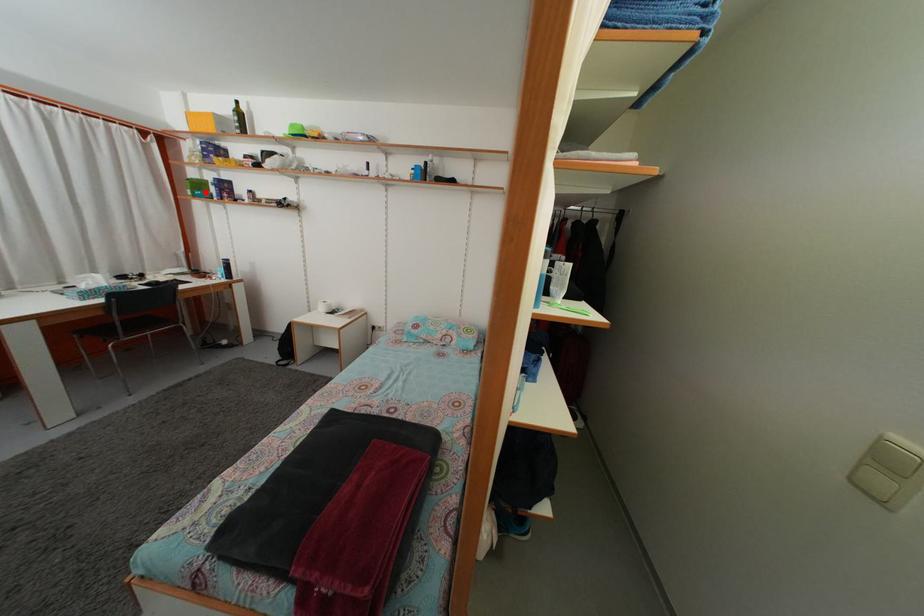
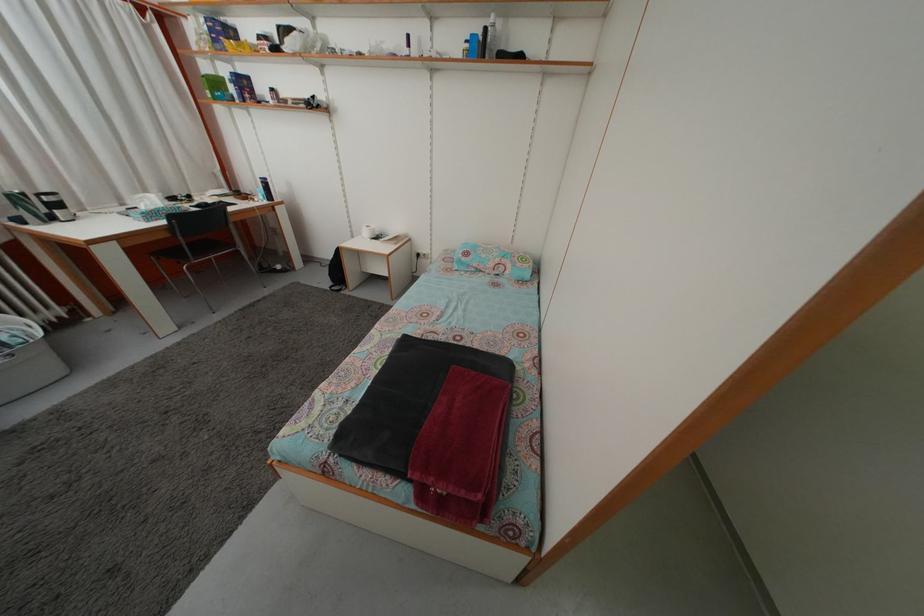
Find the pixel in the second image that matches the highlighted location in the first image.

(223, 91)